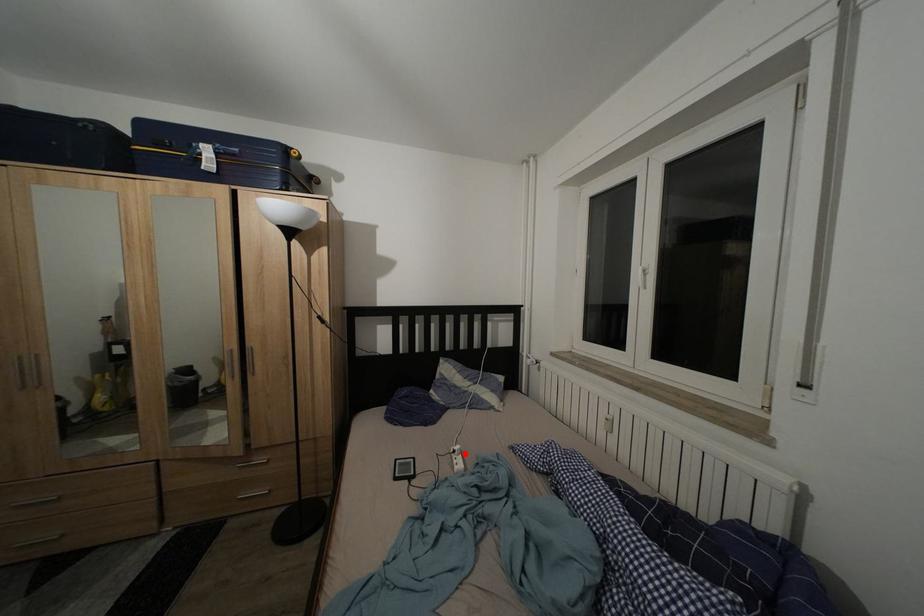
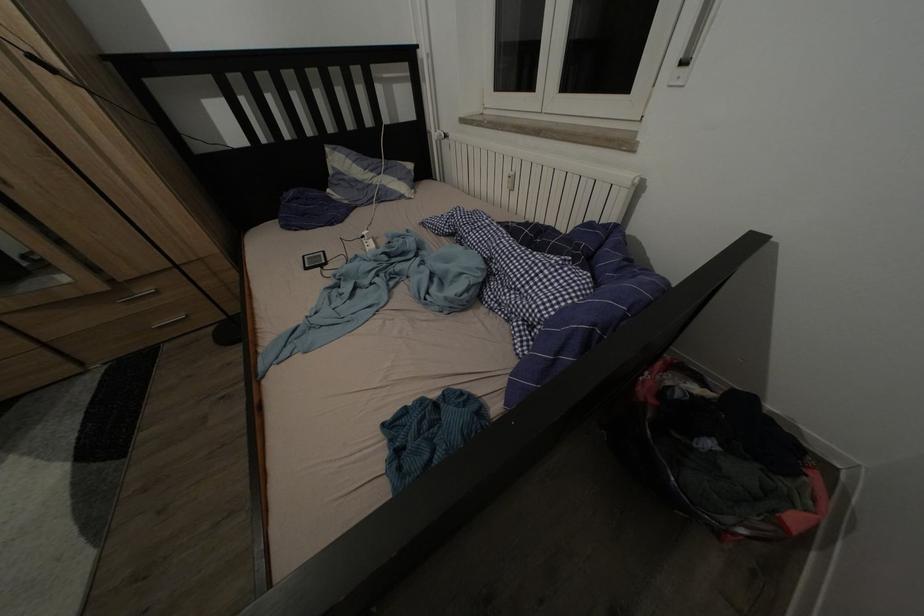
Where in the second image is the point corresponding to the highlighted location from the first image?

(372, 238)